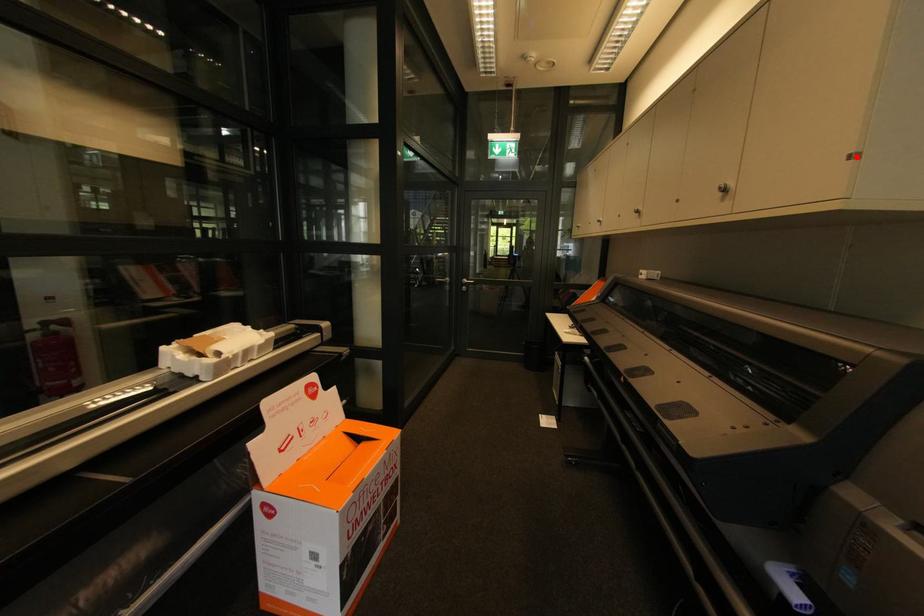
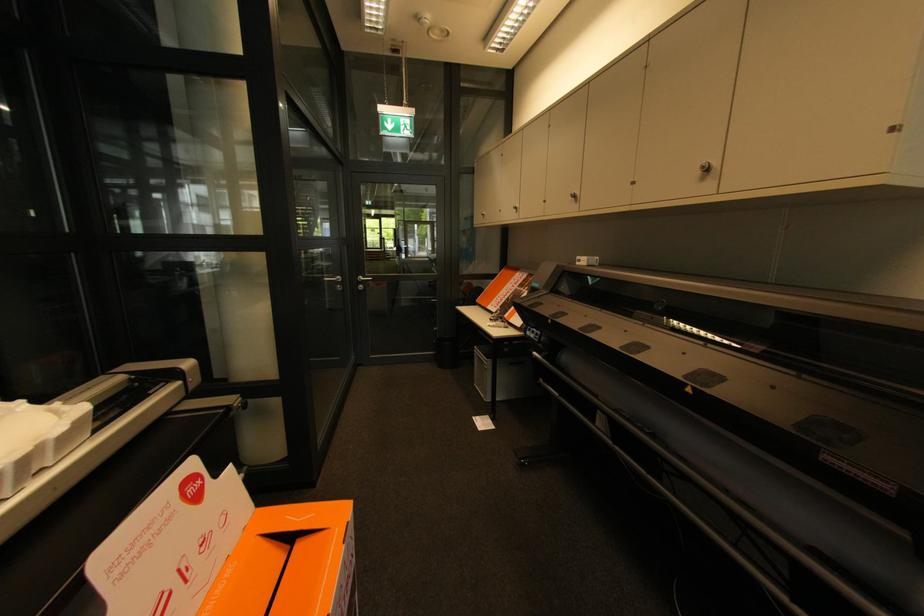
Question: A red point is marked in image1. In image2, is the corresponding 3D point closer to the camera or farther? Reply with the corresponding letter.

Choices:
 (A) The corresponding 3D point is closer.
 (B) The corresponding 3D point is farther.

Answer: (B)